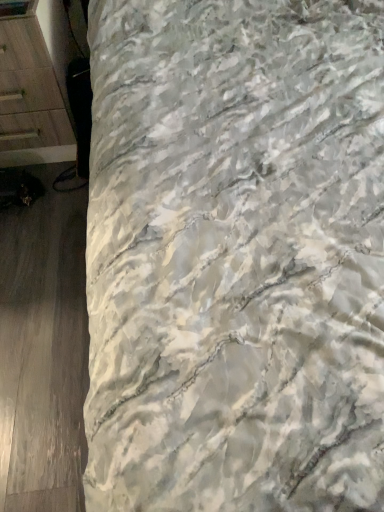
What do you see at coordinates (35, 86) in the screenshot?
I see `wooden chest of drawers at lower left` at bounding box center [35, 86].

Where is `wooden chest of drawers at lower left`? The image size is (384, 512). wooden chest of drawers at lower left is located at coordinates (35, 86).

Where is `wooden chest of drawers at lower left`? This screenshot has height=512, width=384. wooden chest of drawers at lower left is located at coordinates 35,86.